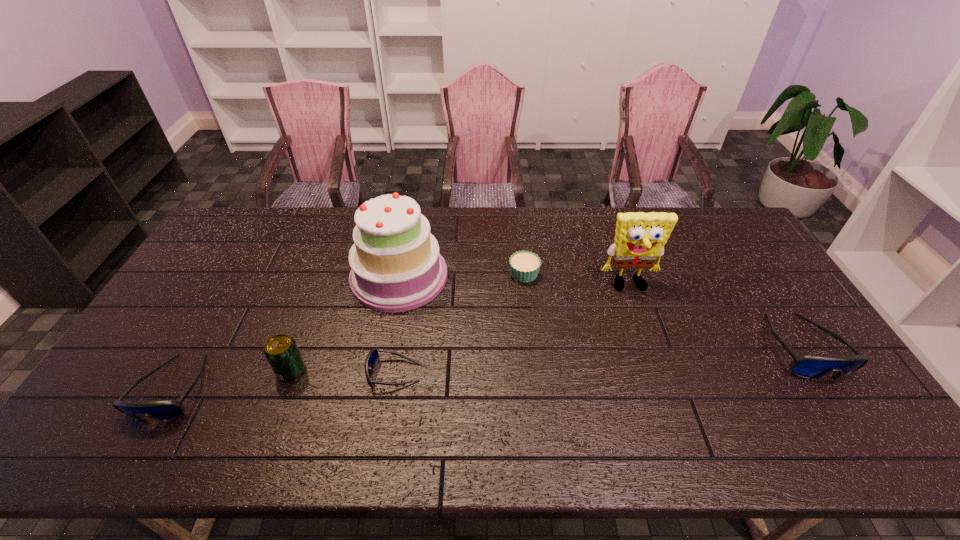
If we want them evenly spaced by inserting an extra sunglasses among them, please locate a free spot for this new sunglasses. Please provide its 2D coordinates. Your answer should be formatted as a tuple, i.e. [(x, y)], where the tuple contains the x and y coordinates of a point satisfying the conditions above.

[(603, 359)]